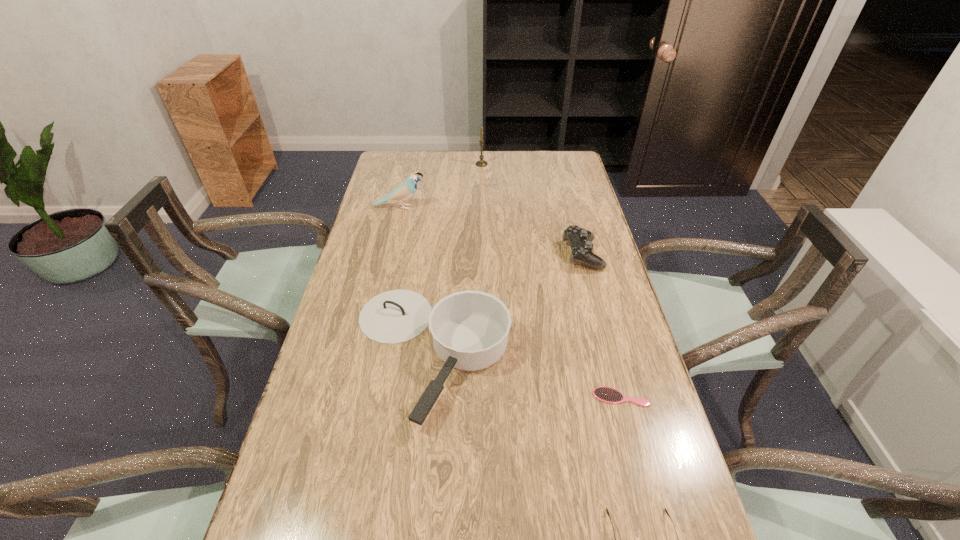
The image size is (960, 540). What are the coordinates of `the farthest object` in the screenshot? It's located at (481, 163).

This screenshot has height=540, width=960. Find the location of `the fifth nearest object`. the fifth nearest object is located at coordinates (405, 190).

At what (x,y) coordinates should I click in order to perform the action: click on the third tallest object. Please return your answer as a coordinate pair (x, y). This screenshot has width=960, height=540. Looking at the image, I should click on (470, 329).

You are a GUI agent. You are given a task and a screenshot of the screen. Output one action in this format:
    pyautogui.click(x=<x>, y=<y>)
    Task: Click on the control
    
    Given the screenshot: What is the action you would take?
    pyautogui.click(x=579, y=239)

The image size is (960, 540). Find the location of `the fourth nearest object`. the fourth nearest object is located at coordinates (579, 239).

Locate an element on the screen. The width and height of the screenshot is (960, 540). the shortest object is located at coordinates (609, 395).

At what (x,y) coordinates should I click in order to perform the action: click on vacant space situated on the left of the candle. Please return your answer as a coordinate pair (x, y). This screenshot has height=540, width=960. Looking at the image, I should click on (x=382, y=164).

Locate an element on the screen. vacant space located at the face of the bird is located at coordinates (476, 207).

Locate an element on the screen. This screenshot has height=540, width=960. vacant space located 0.180m on the right of the saucepan is located at coordinates (581, 352).

The image size is (960, 540). Find the location of `free space located on the front of the control`. free space located on the front of the control is located at coordinates (601, 325).